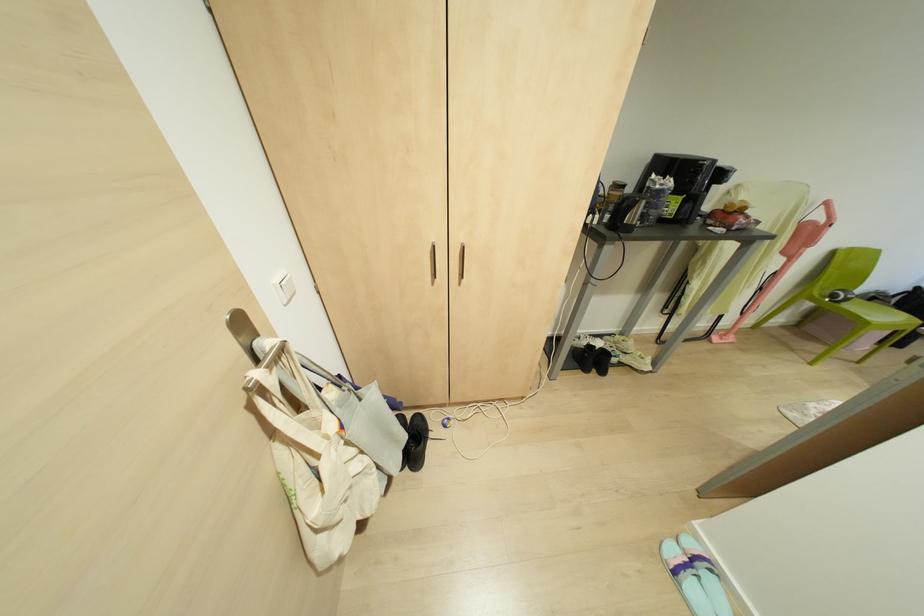
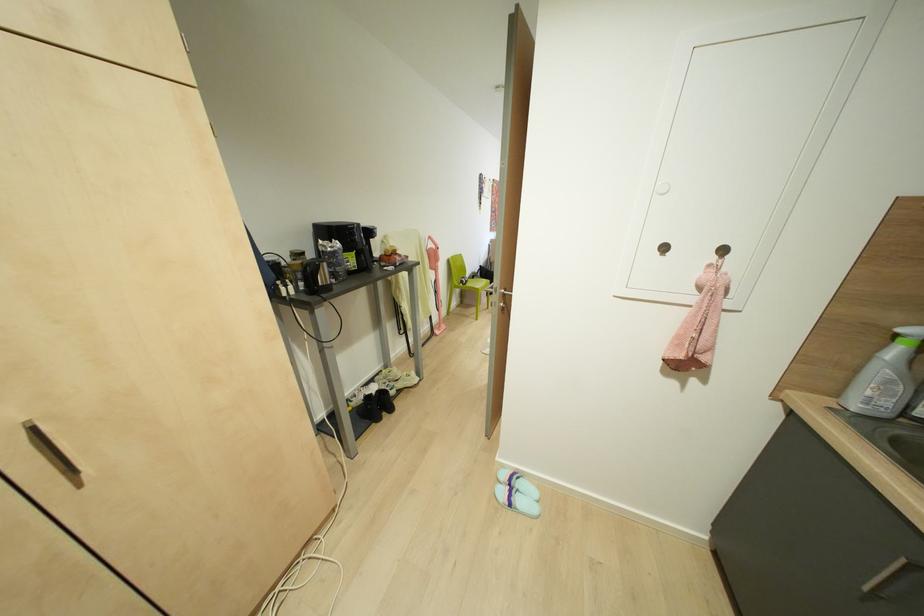
Question: The camera is either moving clockwise (left) or counter-clockwise (right) around the object. The first image is from the beginning of the video and the second image is from the end. Is the camera moving left or right when shooting the video?

Choices:
 (A) Left
 (B) Right

Answer: (A)